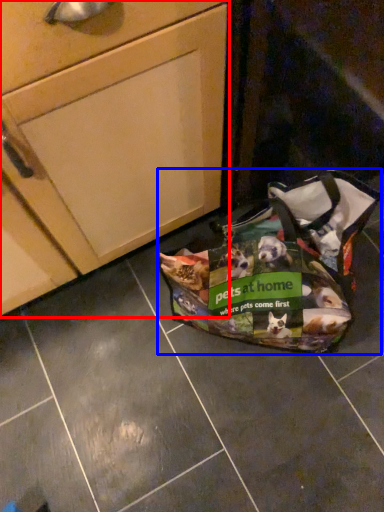
Question: Which object appears closest to the camera in this image, cabinetry (highlighted by a red box) or handbag (highlighted by a blue box)?

Choices:
 (A) cabinetry
 (B) handbag

Answer: (A)